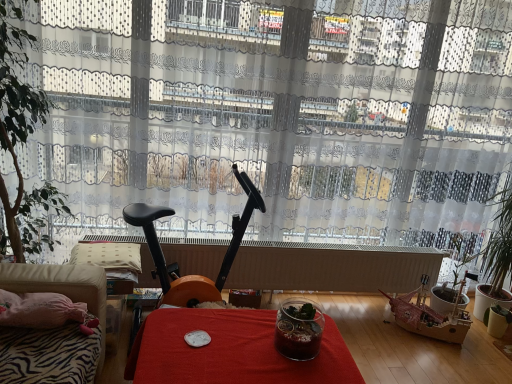
Where is `free location to the right of transparent glass jar at center`? free location to the right of transparent glass jar at center is located at coordinates (333, 351).